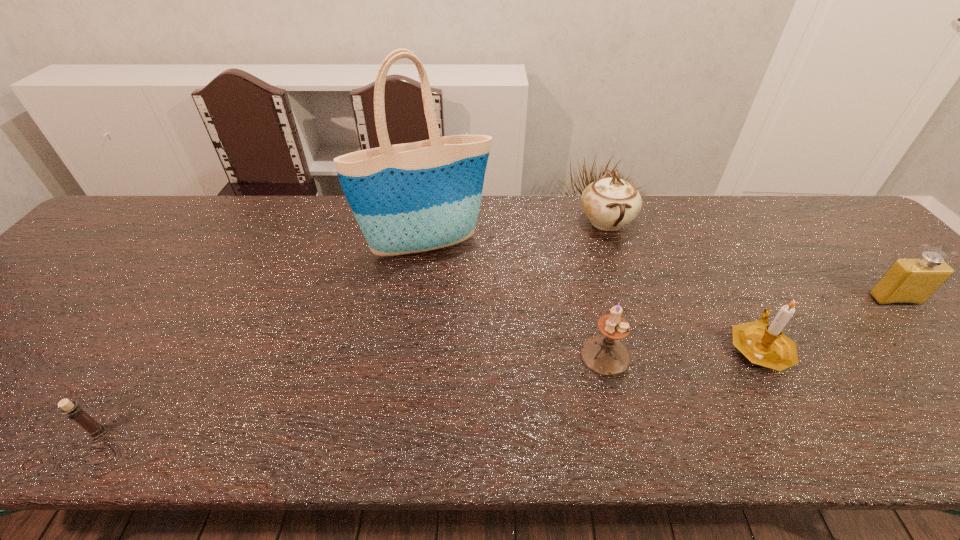
This screenshot has width=960, height=540. What are the coordinates of `tote bag` in the screenshot? It's located at coord(408,198).

Locate an element on the screen. the tallest object is located at coordinates (408, 198).

Where is `chinaware`? The image size is (960, 540). chinaware is located at coordinates (610, 203).

Find the location of a particular element. the third farthest object is located at coordinates (909, 280).

The width and height of the screenshot is (960, 540). Identify the location of perfume. (909, 280).

In order to click on the second candle holder from right to left in this screenshot , I will do `click(606, 355)`.

This screenshot has width=960, height=540. Find the location of `the rightmost candle holder`. the rightmost candle holder is located at coordinates (764, 344).

Locate an element on the screen. the leftmost candle holder is located at coordinates (73, 411).

At what (x,y) coordinates should I click in order to perform the action: click on the shortest object. Please return your answer as a coordinate pair (x, y). Image resolution: width=960 pixels, height=540 pixels. Looking at the image, I should click on (73, 411).

The image size is (960, 540). Identify the location of vacant area situated on the back of the tallest object. (432, 204).